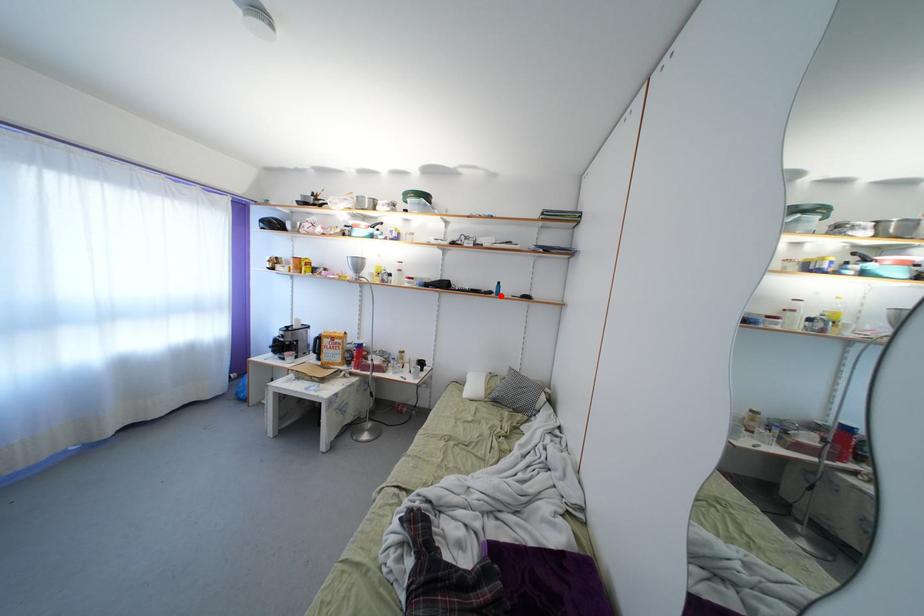
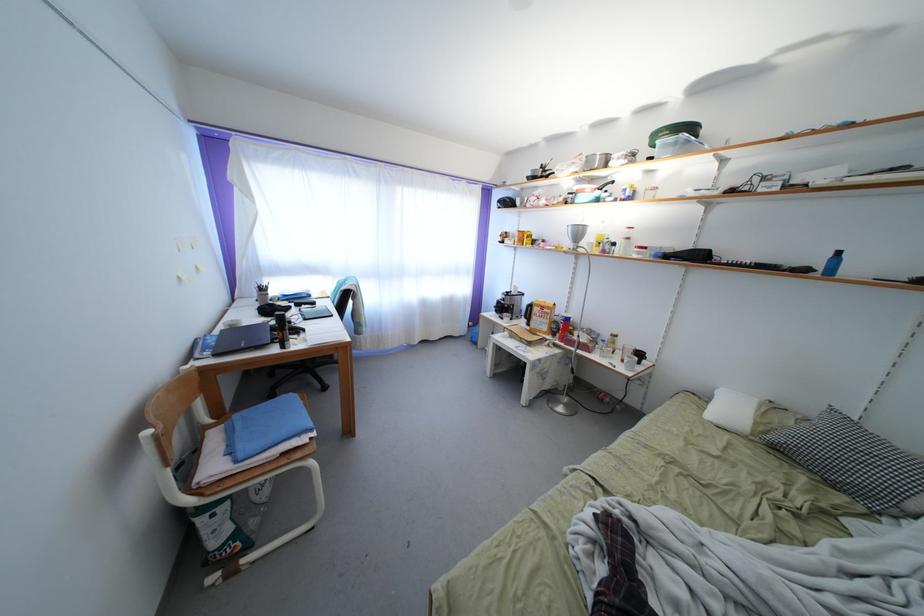
Where in the second image is the point corresponding to the highlighted location from the first image?

(823, 272)